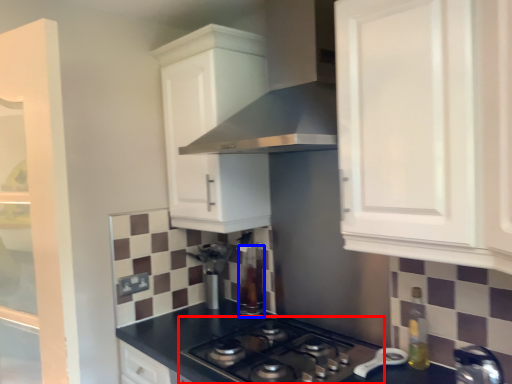
Question: Among these objects, which one is farthest to the camera, gas stove (highlighted by a red box) or appliance (highlighted by a blue box)?

Choices:
 (A) gas stove
 (B) appliance

Answer: (B)